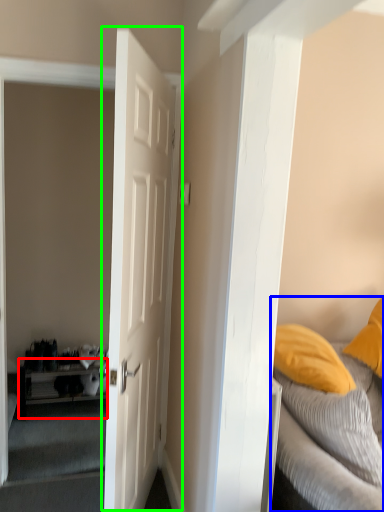
Question: Considering the real-world distances, which object is farthest from table (highlighted by a red box)? bed (highlighted by a blue box) or door (highlighted by a green box)?

Choices:
 (A) bed
 (B) door

Answer: (A)